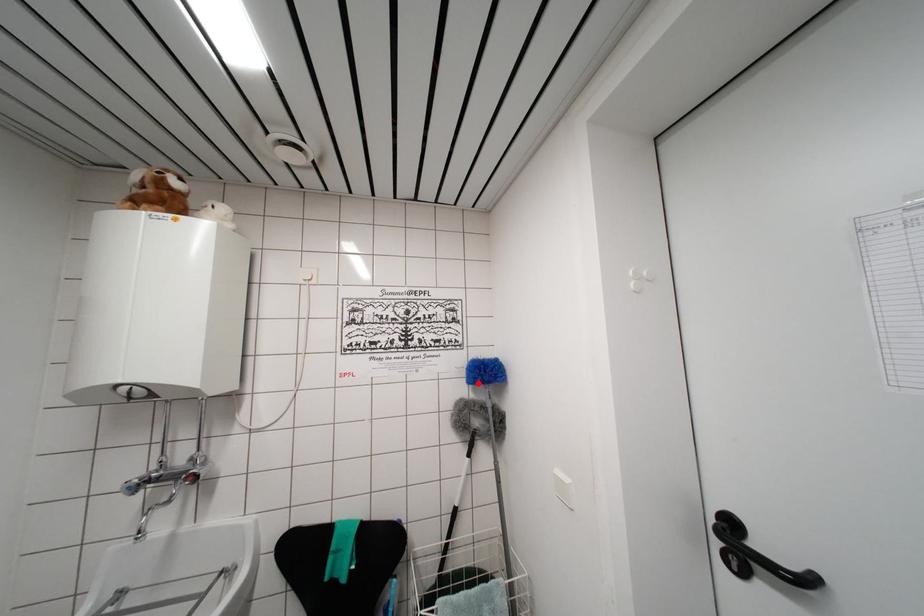
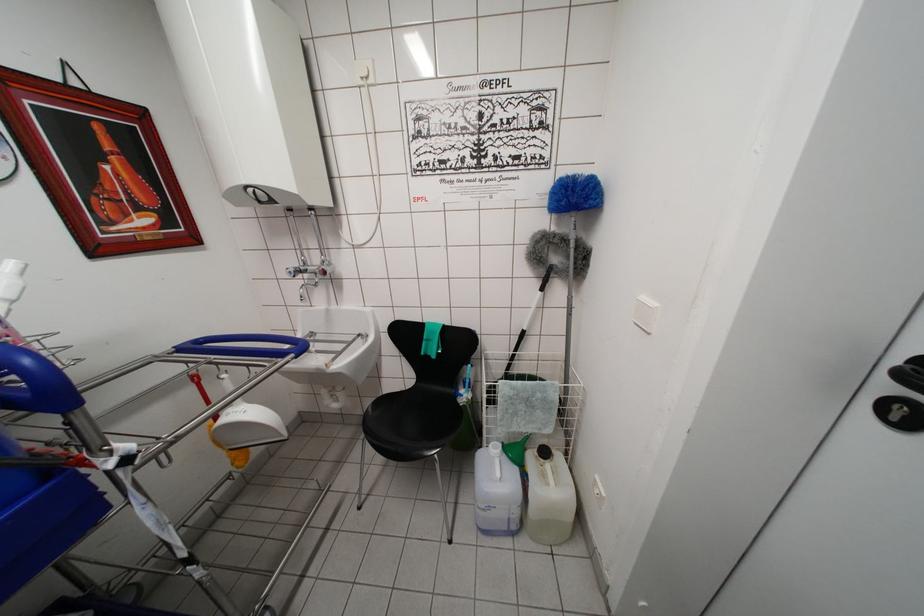
Locate, in the second image, the point that corresponds to the highlighted location in the first image.

(562, 206)